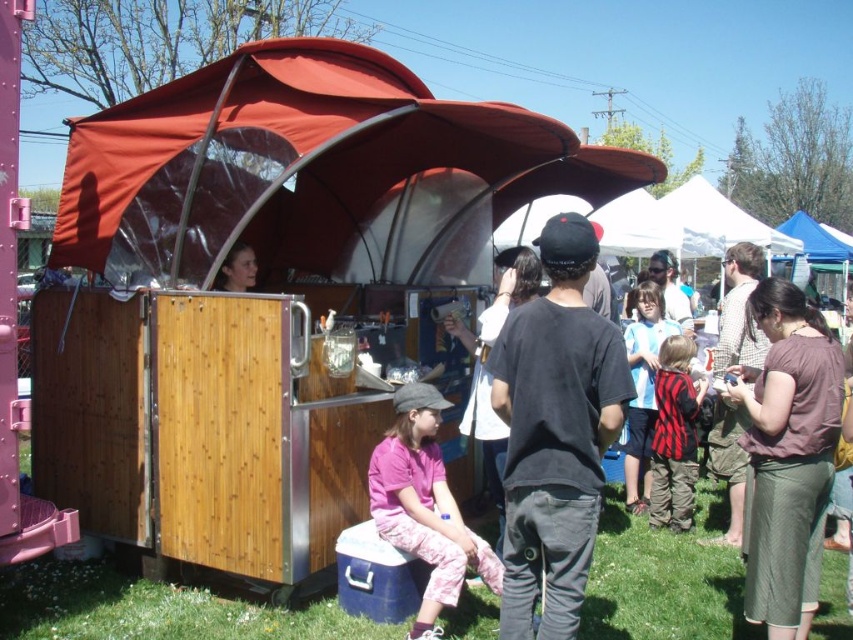
Question: Which object is positioned farthest from the brown textured skirt at lower right?

Choices:
 (A) brown fabric skirt at lower right
 (B) red and black striped vest at center

Answer: (A)

Question: Which object appears farthest from the camera in this image?

Choices:
 (A) striped fabric shirt at center
 (B) brown fabric skirt at lower right

Answer: (A)

Question: Which is farther from the brown fabric skirt at lower right?

Choices:
 (A) matte black hair at center
 (B) red fabric canopy at center
 (C) black cotton t-shirt at center
 (D) red and black striped vest at center

Answer: (A)

Question: Is pink cotton shirt at lower center wider than brown textured skirt at lower right?

Choices:
 (A) no
 (B) yes

Answer: (A)

Question: Does pink cotton shirt at lower center have a larger size compared to matte black hair at center?

Choices:
 (A) yes
 (B) no

Answer: (A)

Question: Is pink cotton shirt at lower center to the right of brown textured skirt at lower right from the viewer's perspective?

Choices:
 (A) yes
 (B) no

Answer: (B)